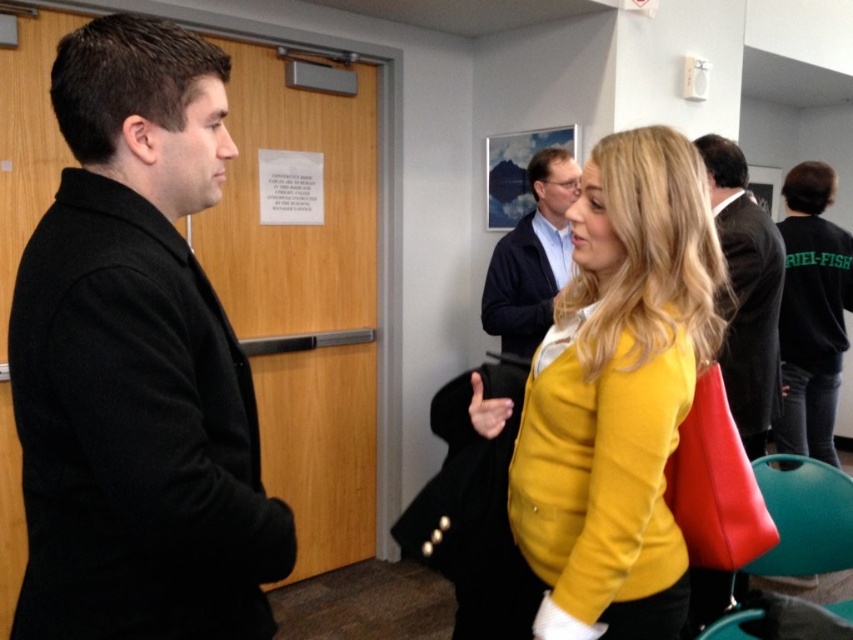
You are organizing a charity event and need to display two jackets on a mannequin. The yellow matte jacket at center and the blue fabric jacket at center must be arranged so that the larger one is on top. Which jacket should be placed on top?

The yellow matte jacket at center should be placed on top because it has a larger size compared to the blue fabric jacket at center.